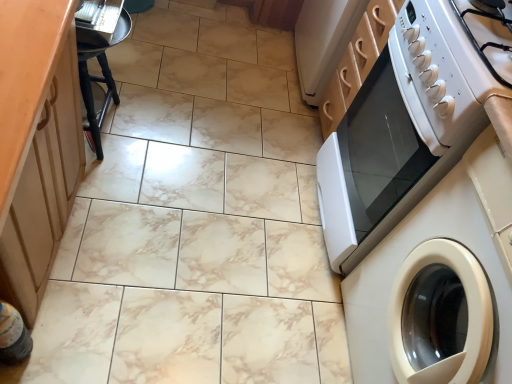
Question: In terms of size, does white glossy washing machine at right appear bigger or smaller than wooden cabinet at left?

Choices:
 (A) small
 (B) big

Answer: (A)

Question: From a real-world perspective, relative to wooden cabinet at left, is white glossy washing machine at right vertically above or below?

Choices:
 (A) below
 (B) above

Answer: (B)

Question: Which object is positioned farthest from the black wood stool at left?

Choices:
 (A) white glossy gas stove at upper right
 (B) wooden cabinet at left
 (C) white glossy oven at right
 (D) white glossy washing machine at right
 (E) translucent plastic bottle at lower left

Answer: (D)

Question: Which object is the farthest from the translucent plastic bottle at lower left?

Choices:
 (A) black wood stool at left
 (B) white glossy washing machine at right
 (C) white glossy gas stove at upper right
 (D) white glossy oven at right
 (E) wooden cabinet at left

Answer: (C)